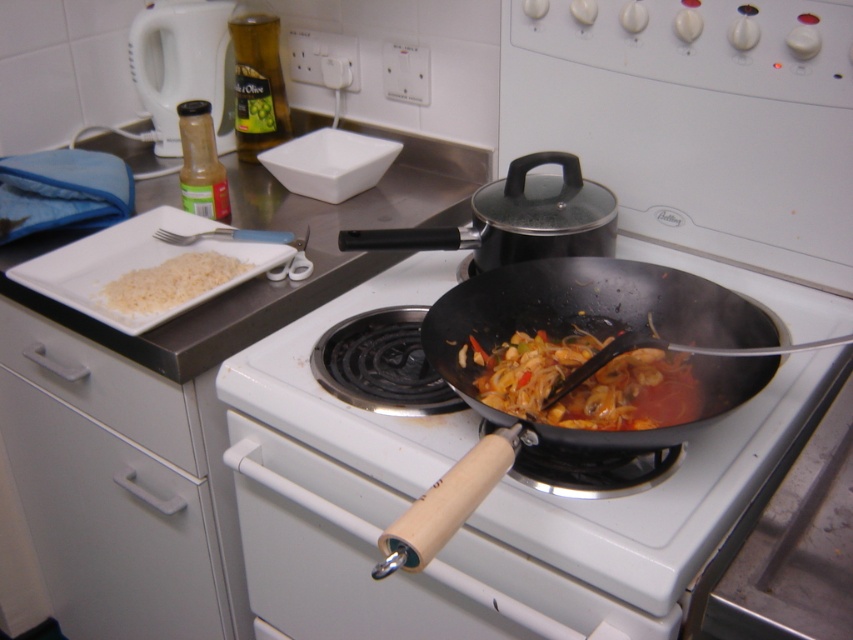
Is shiny silver pot at upper center in front of white matte rice at left?

Yes, shiny silver pot at upper center is in front of white matte rice at left.

Does shiny silver pot at upper center have a greater width compared to white matte rice at left?

Correct, the width of shiny silver pot at upper center exceeds that of white matte rice at left.

Between point (525, 250) and point (178, 259), which one is positioned in front?

Positioned in front is point (525, 250).

This screenshot has height=640, width=853. Find the location of `shiny silver pot at upper center`. shiny silver pot at upper center is located at coordinates (515, 218).

Which is behind, point (601, 316) or point (492, 202)?

The point (492, 202) is more distant.

Does point (671, 285) come farther from viewer compared to point (490, 189)?

No, it is not.

Which is behind, point (718, 358) or point (418, 244)?

The point (418, 244) is more distant.

Identify the location of black matte frying pan at center. This screenshot has height=640, width=853. (602, 312).

Does shiny silver pot at upper center come behind translucent plastic bottle at upper left?

No, shiny silver pot at upper center is in front of translucent plastic bottle at upper left.

The image size is (853, 640). What are the coordinates of `shiny silver pot at upper center` in the screenshot? It's located at (515, 218).